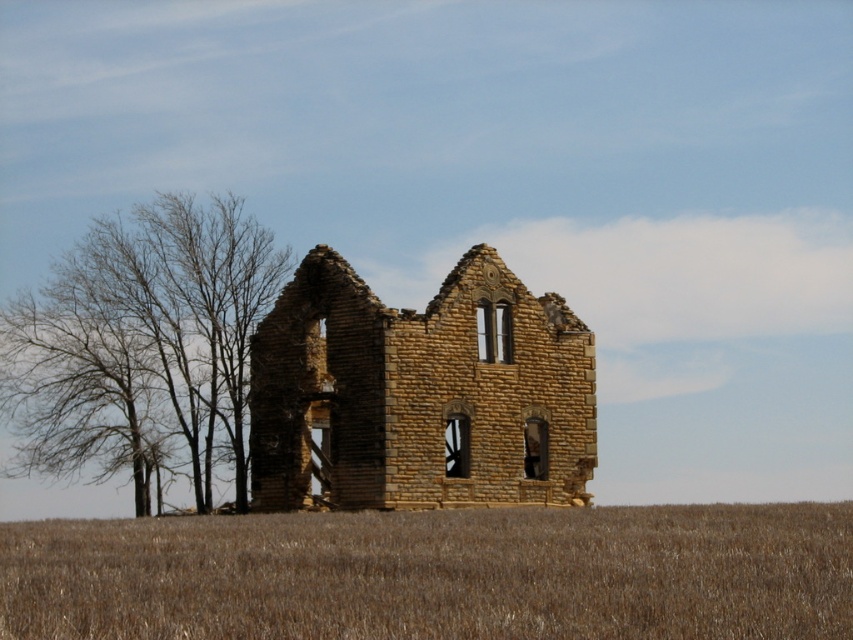
You are standing in the image and want to move towards the brown grassland at lower center. What are the coordinates you need to aim for?

The coordinates to aim for are point (436,573).

Consider the image. You are standing at the point marked by point [436,573], which is on brown grassland at lower center. You want to walk towards the dilapidated stone structure. Which direction should you head?

Since you are on the brown grassland at lower center marked by point [436,573], the dilapidated stone structure is located in front of you, so you should head forward towards it.

You are an archaeologist examining the brown stone ruins at center and the bare branches at left in the image. Which object takes up less space in the scene?

The brown stone ruins at center takes up less space compared to the bare branches at left.